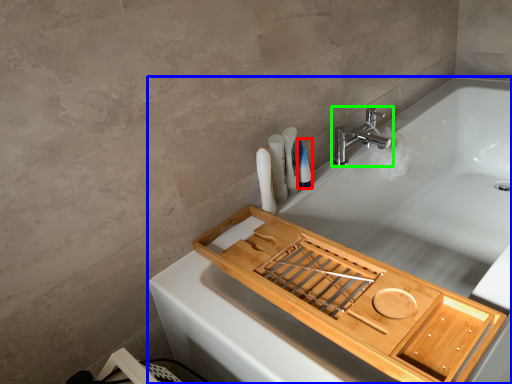
Question: Which object is positioned closest to toiletry (highlighted by a red box)? Select from bathtub (highlighted by a blue box) and tap (highlighted by a green box).

Choices:
 (A) bathtub
 (B) tap

Answer: (B)